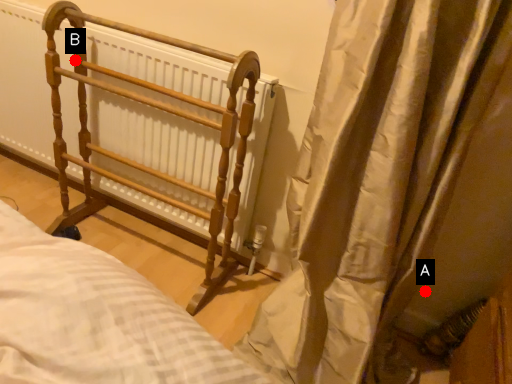
Question: Two points are circled on the image, labeled by A and B beside each circle. Among these points, which one is nearest to the camera?

Choices:
 (A) A is closer
 (B) B is closer

Answer: (A)